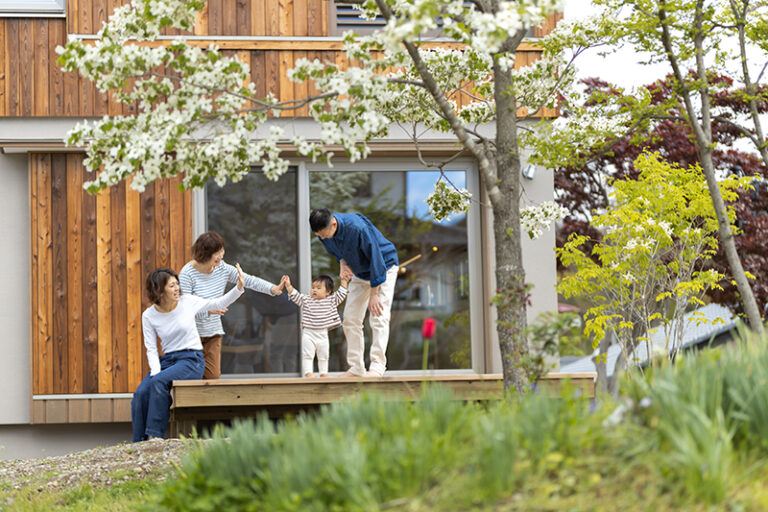
Find the location of a particular element. This screenshot has height=512, width=768. window is located at coordinates (454, 262).